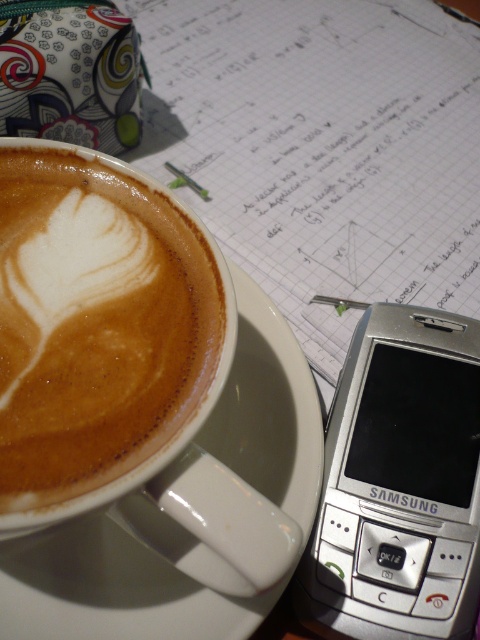
Consider the image. Is latte art at upper left thinner than white glossy saucer at upper center?

Indeed, latte art at upper left has a lesser width compared to white glossy saucer at upper center.

In the scene shown: Can you confirm if latte art at upper left is shorter than white glossy saucer at upper center?

Yes, latte art at upper left is shorter than white glossy saucer at upper center.

Does point (37, 458) come closer to viewer compared to point (263, 312)?

That is True.

Where is `latte art at upper left`? Image resolution: width=480 pixels, height=640 pixels. latte art at upper left is located at coordinates (95, 323).

Which is behind, point (142, 589) or point (349, 534)?

The point (349, 534) is more distant.

Is white glossy saucer at upper center shorter than silver metallic samsung phone at upper right?

In fact, white glossy saucer at upper center may be taller than silver metallic samsung phone at upper right.

This screenshot has height=640, width=480. In order to click on white glossy saucer at upper center in this screenshot , I will do `click(180, 524)`.

At what (x,y) coordinates should I click in order to perform the action: click on white glossy saucer at upper center. Please return your answer as a coordinate pair (x, y). The width and height of the screenshot is (480, 640). Looking at the image, I should click on (180, 524).

Does latte art at upper left come behind silver metallic samsung phone at upper right?

No, latte art at upper left is closer to the viewer.

Who is shorter, latte art at upper left or silver metallic samsung phone at upper right?

Standing shorter between the two is latte art at upper left.

Is point (172, 378) less distant than point (408, 448)?

Yes, point (172, 378) is in front of point (408, 448).

Where is `latte art at upper left`? latte art at upper left is located at coordinates (95, 323).